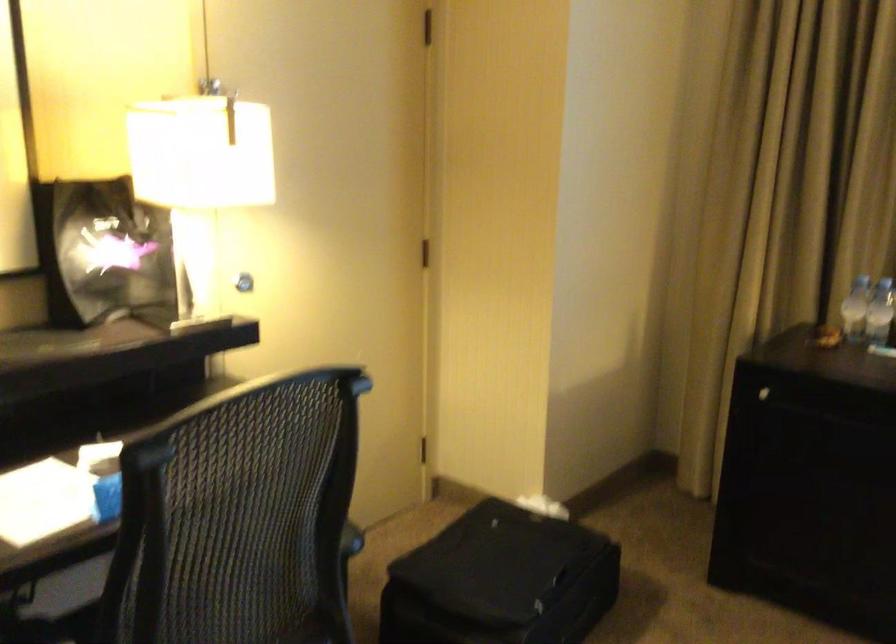
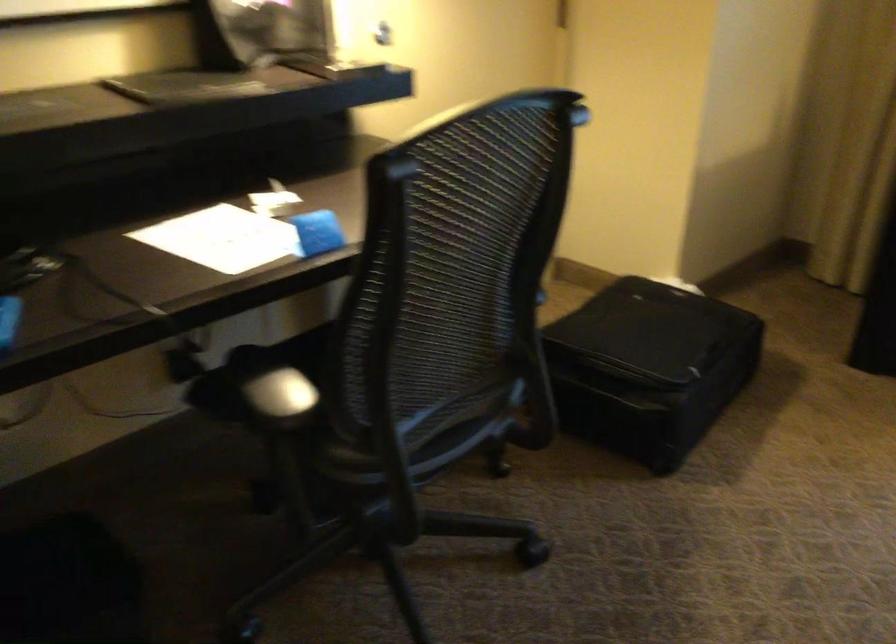
Question: The images are taken continuously from a first-person perspective. In which direction are you moving?

Choices:
 (A) Left
 (B) Right
 (C) Forward
 (D) Backward

Answer: (A)